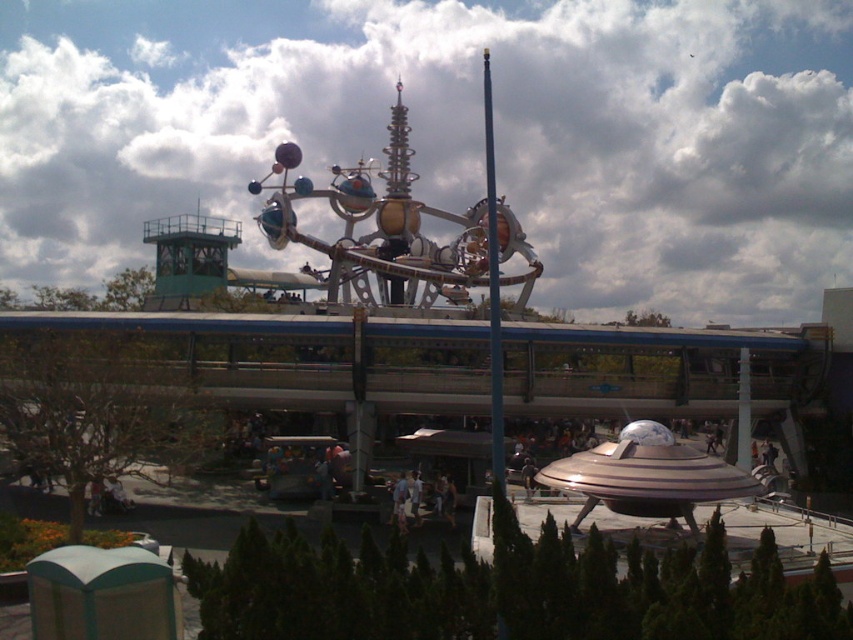
Based on the provided coordinates, where is the metallic silver amusement ride at center located in the image?

The metallic silver amusement ride at center is located at point coordinates of 0.356 on the x axis and 0.471 on the y axis.

You are standing at the entrance of the futuristic theme park and see the metallic silver amusement ride at center and the metallic pole at center. Which object is closer to you?

The metallic silver amusement ride at center is closer to you because the metallic pole at center is behind it.

In the theme park scene, there is a metallic silver amusement ride at center and a metallic pole at center. Which one is positioned to the left?

The metallic silver amusement ride at center is to the left of the metallic pole at center.